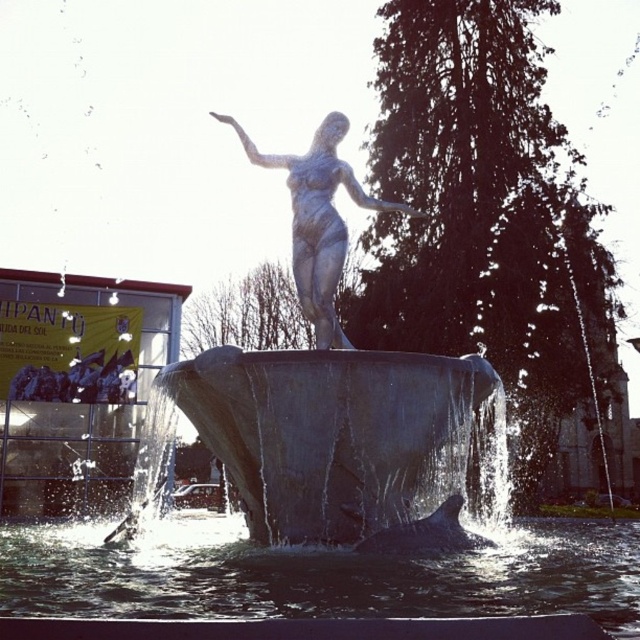
Which of these two, clear water at center or satin silver statue at center, stands taller?

satin silver statue at center

Is clear water at center thinner than satin silver statue at center?

No.

In the scene shown: Who is more forward, (113, 600) or (300, 298)?

Positioned in front is point (113, 600).

The width and height of the screenshot is (640, 640). In order to click on clear water at center in this screenshot , I will do `click(316, 573)`.